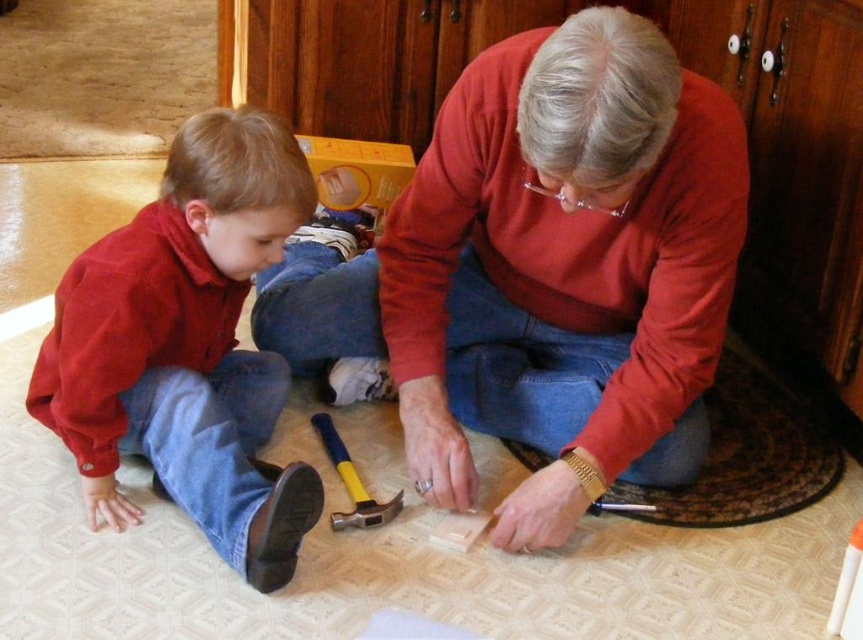
Question: Is matte red shirt at lower left thinner than yellow rubber hammer at center?

Choices:
 (A) no
 (B) yes

Answer: (A)

Question: Is matte red shirt at lower left bigger than yellow rubber hammer at center?

Choices:
 (A) no
 (B) yes

Answer: (B)

Question: Which of the following is the closest to the observer?

Choices:
 (A) (106, 392)
 (B) (351, 486)
 (C) (739, 220)

Answer: (C)

Question: Does matte wood block at center appear under matte red shirt at lower left?

Choices:
 (A) no
 (B) yes

Answer: (A)

Question: Considering the real-world distances, which object is farthest from the yellow rubber hammer at center?

Choices:
 (A) matte red shirt at lower left
 (B) matte wood block at center

Answer: (B)

Question: Which point is farther from the camera taking this photo?

Choices:
 (A) (328, 454)
 (B) (240, 531)
 (C) (595, 424)

Answer: (A)